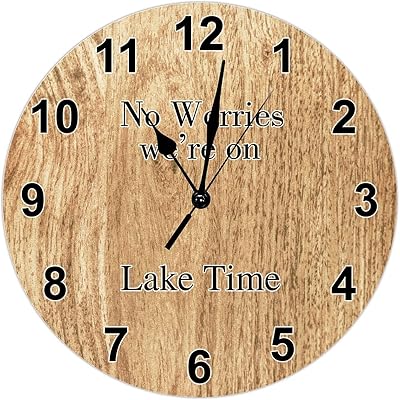
In order to click on small clock hand in this screenshot , I will do `click(167, 146)`.